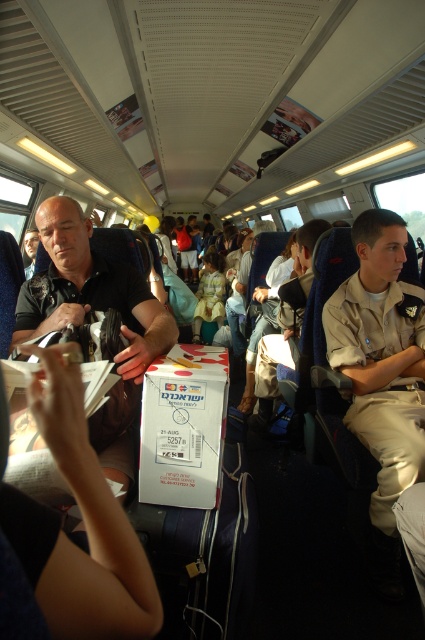
Question: Is khaki uniform at right wider than matte black shirt at left?

Choices:
 (A) yes
 (B) no

Answer: (B)

Question: Does khaki uniform at right appear under matte black shirt at left?

Choices:
 (A) yes
 (B) no

Answer: (A)

Question: Among these objects, which one is farthest from the camera?

Choices:
 (A) matte black shirt at left
 (B) khaki uniform at right

Answer: (B)

Question: Which point is farther from the camera taking this photo?

Choices:
 (A) (133, 362)
 (B) (379, 266)

Answer: (B)

Question: Can you confirm if khaki uniform at right is positioned to the right of matte black shirt at left?

Choices:
 (A) yes
 (B) no

Answer: (A)